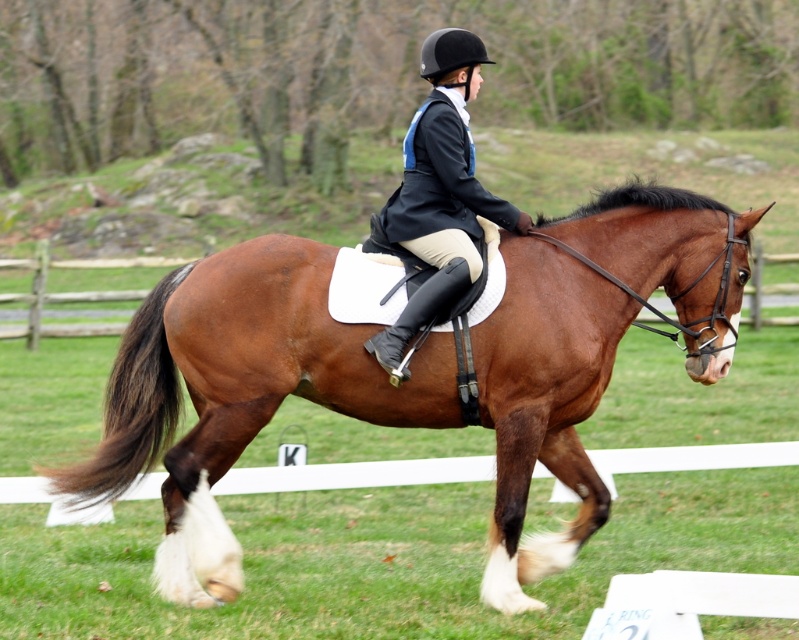
You are a GUI agent. You are given a task and a screenshot of the screen. Output one action in this format:
    pyautogui.click(x=<x>, y=<y>)
    Task: Click on the brown glossy horse at center
    
    Given the screenshot: What is the action you would take?
    pos(237,392)

Can you confirm if brown glossy horse at center is positioned above brown silky tail at lower left?

Actually, brown glossy horse at center is below brown silky tail at lower left.

Locate an element on the screen. brown glossy horse at center is located at coordinates (237, 392).